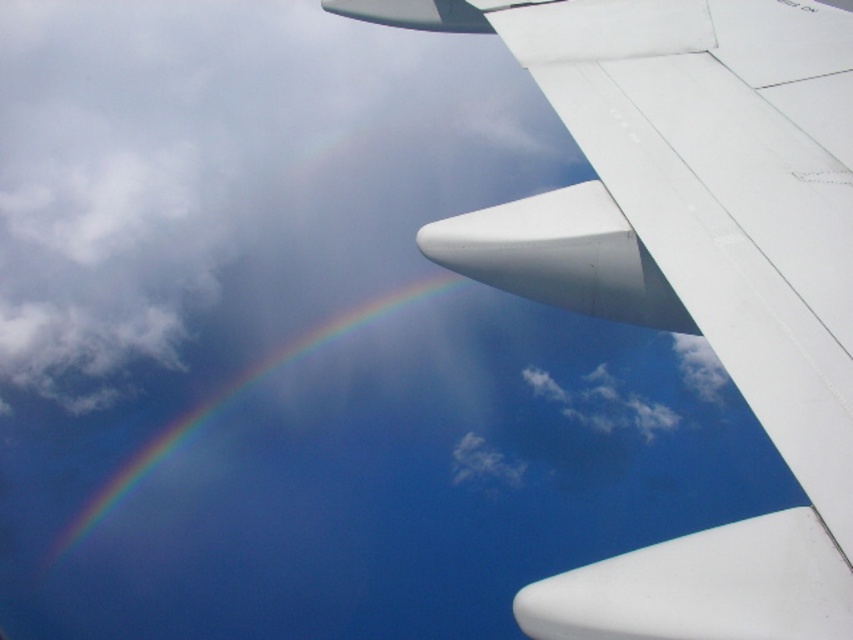
You are a passenger on an airplane and looking out the window. You see the white matte airplane wing at upper right and the rainbow at upper left. Which object appears taller in the scene?

The rainbow at upper left appears taller than the white matte airplane wing at upper right because the white matte airplane wing at upper right is not as tall as rainbow at upper left.

You are a pilot looking at the aircraft wing from the cockpit. Based on the coordinates provided, where exactly is the white matte airplane wing at upper right located?

The white matte airplane wing at upper right is located at point [691,269].

You are sitting in an airplane seat and notice a point marked at coordinates (x=840, y=484) on the window. If you want to touch this point with your finger, which is 0.1 meters long, will your finger reach it without moving your hand?

The point at (x=840, y=484) is 1.35 meters away from you. Since your finger is only 0.1 meters long, you cannot reach it without moving your hand.